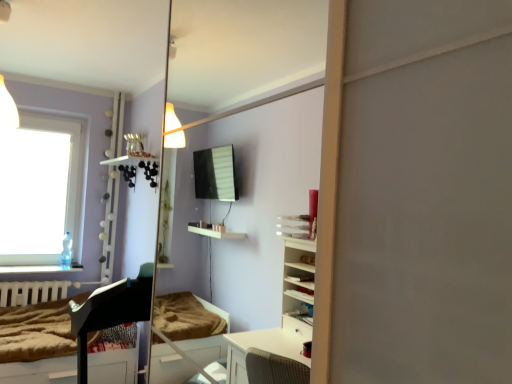
Question: From a real-world perspective, is black glossy piano at lower left positioned above or below white matte radiator at lower left?

Choices:
 (A) below
 (B) above

Answer: (A)

Question: From the image's perspective, is black glossy piano at lower left above or below white matte radiator at lower left?

Choices:
 (A) above
 (B) below

Answer: (B)

Question: Estimate the real-world distances between objects in this image. Which object is closer to the clear glass window at upper left?

Choices:
 (A) black glossy piano at lower left
 (B) brown textured mattress at lower left
 (C) white matte radiator at lower left

Answer: (C)

Question: Which object is positioned closest to the brown textured mattress at lower left?

Choices:
 (A) white matte radiator at lower left
 (B) black glossy piano at lower left
 (C) clear glass window at upper left

Answer: (A)